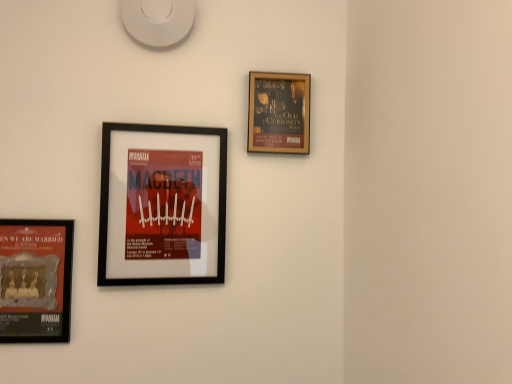
Question: Considering their positions, is matte black poster at lower left, which is the first picture frame from left to right, located in front of or behind black matte picture frame at center-left, which is the 2th picture frame in right-to-left order?

Choices:
 (A) behind
 (B) front

Answer: (B)

Question: In the image, is matte black poster at lower left, which is the first picture frame from left to right, on the left side or the right side of black matte picture frame at center-left, which is the 2th picture frame in right-to-left order?

Choices:
 (A) right
 (B) left

Answer: (B)

Question: Based on their relative distances, which object is nearer to the black matte picture frame at center-left, placed as the second picture frame when sorted from left to right?

Choices:
 (A) gold-framed poster at upper right, which appears as the third picture frame when viewed from the left
 (B) matte black poster at lower left, which is the first picture frame from left to right

Answer: (B)

Question: Based on their relative distances, which object is nearer to the matte black poster at lower left, which is the first picture frame from left to right?

Choices:
 (A) gold-framed poster at upper right, which appears as the third picture frame when viewed from the left
 (B) black matte picture frame at center-left, which is the 2th picture frame in right-to-left order

Answer: (B)